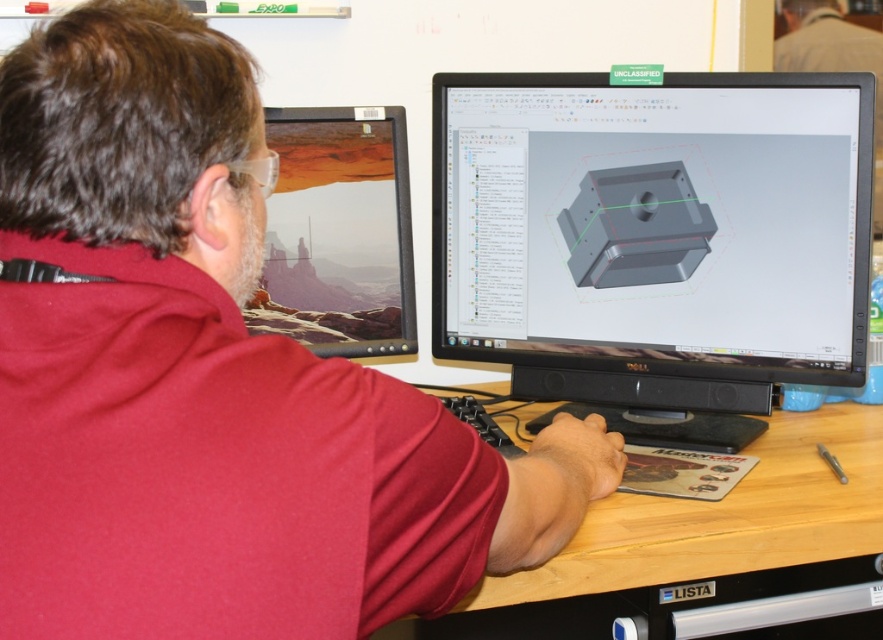
You are a photographer taking a picture of the scene. You notice the red matte shirt at center and the matte black monitor at left. Which object should you focus on to ensure the other is in the background?

You should focus on the red matte shirt at center because it is closer to the viewer than the matte black monitor at left, so if you focus on it, the monitor will naturally be in the background.

You are a delivery person who needs to place a small package between the red matte shirt at center and the matte black monitor at left. The package is 24 inches long. Will it fit in the space between them?

The distance between the red matte shirt at center and the matte black monitor at left is 23.04 inches. Since the package is 24 inches long, it will not fit in the space between them.

You are setting up a new desk arrangement. You have a matte black monitor at center and light brown wood at center. Which object is taller?

The matte black monitor at center is much taller than the light brown wood at center.